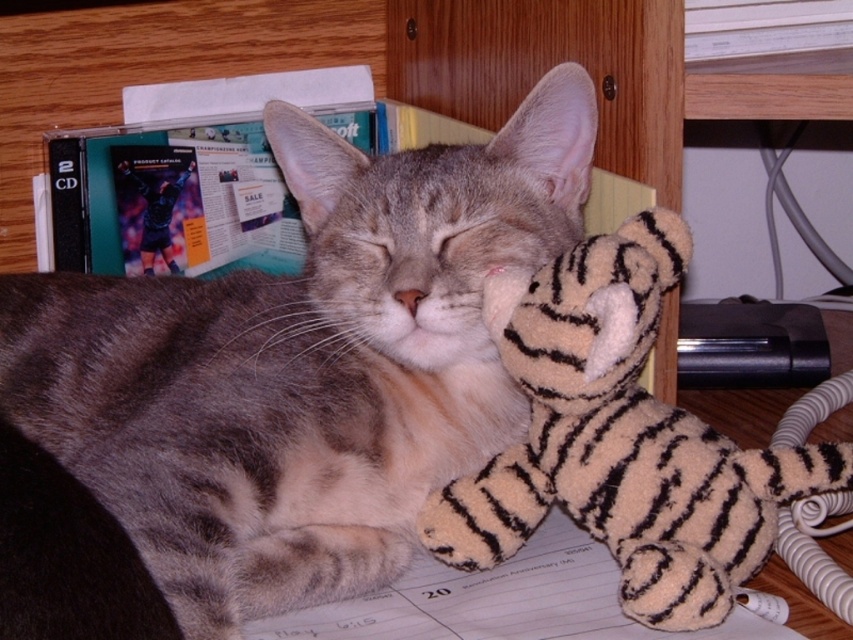
Question: Which of the following is the farthest from the observer?

Choices:
 (A) fuzzy beige tiger at center
 (B) gray striped fur cat at center

Answer: (A)

Question: Does gray striped fur cat at center appear over fuzzy beige tiger at center?

Choices:
 (A) no
 (B) yes

Answer: (B)

Question: Is gray striped fur cat at center in front of fuzzy beige tiger at center?

Choices:
 (A) no
 (B) yes

Answer: (B)

Question: Which point appears farthest from the camera in this image?

Choices:
 (A) (613, 534)
 (B) (125, 394)

Answer: (B)

Question: Is gray striped fur cat at center closer to the viewer compared to fuzzy beige tiger at center?

Choices:
 (A) no
 (B) yes

Answer: (B)